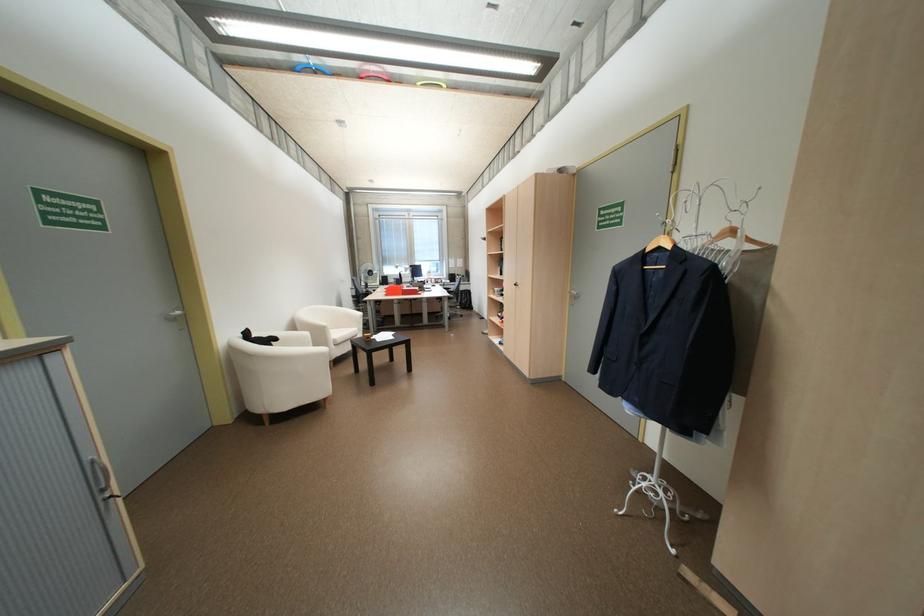
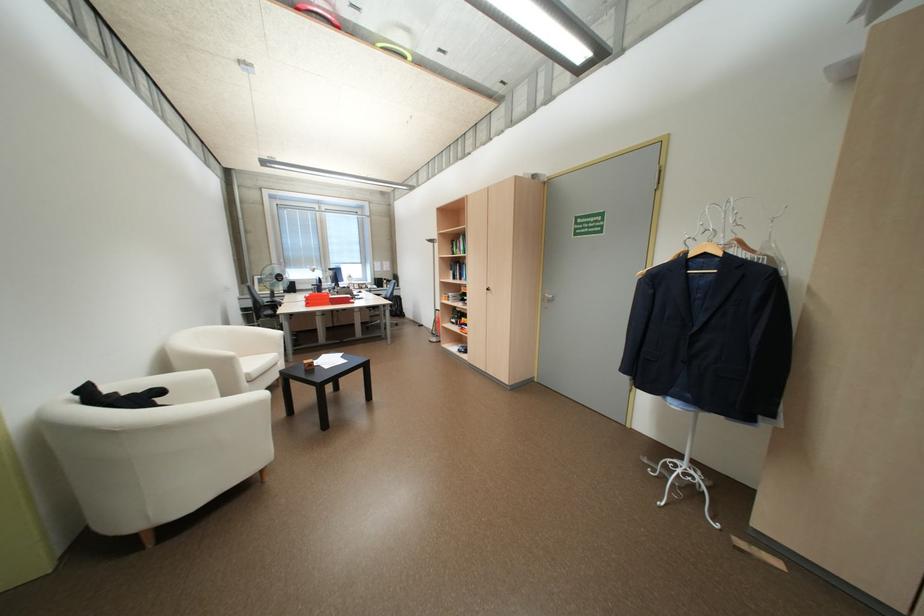
Where in the second image is the point corresponding to point (416, 288) from the first image?

(342, 296)